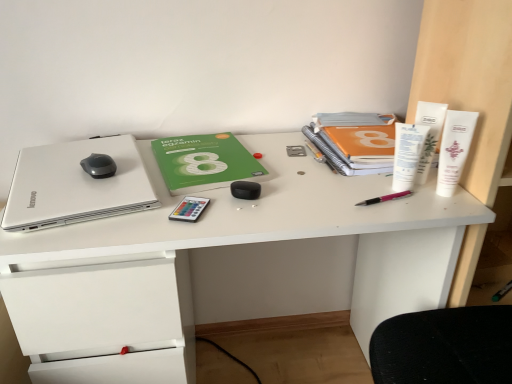
The height and width of the screenshot is (384, 512). In order to click on unoccupied space behind pink metallic pen at center-right, which is the second stationery in left-to-right order in this screenshot , I will do `click(350, 172)`.